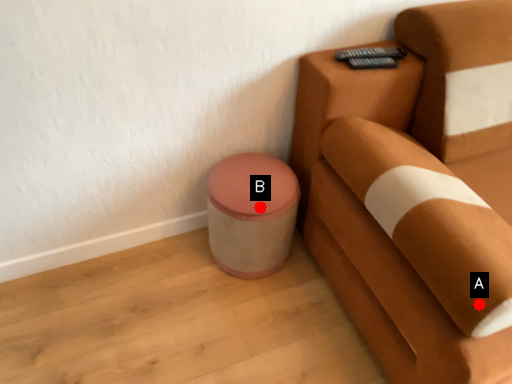
Question: Two points are circled on the image, labeled by A and B beside each circle. Which point is further to the camera?

Choices:
 (A) A is further
 (B) B is further

Answer: (B)